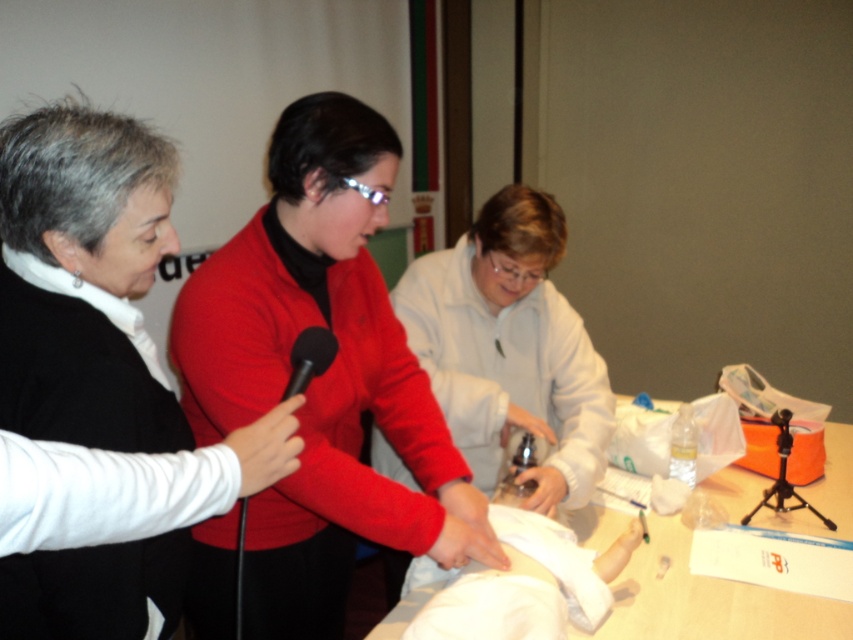
Question: Does matte red sweater at center have a smaller size compared to wooden table at center?

Choices:
 (A) no
 (B) yes

Answer: (A)

Question: Which point appears farthest from the camera in this image?

Choices:
 (A) (332, 340)
 (B) (135, 378)

Answer: (A)

Question: Can you confirm if matte black jacket at left is positioned below black matte microphone at center?

Choices:
 (A) yes
 (B) no

Answer: (A)

Question: Which object appears farthest from the camera in this image?

Choices:
 (A) matte black jacket at left
 (B) matte red sweater at center
 (C) black matte microphone at center

Answer: (C)

Question: Which of the following is the farthest from the observer?

Choices:
 (A) (305, 348)
 (B) (795, 515)
 (C) (134, 570)

Answer: (B)

Question: Does matte red sweater at center appear under matte black jacket at left?

Choices:
 (A) yes
 (B) no

Answer: (A)